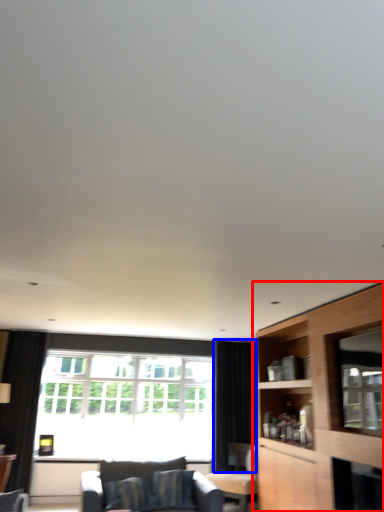
Question: Among these objects, which one is farthest to the camera, cabinetry (highlighted by a red box) or curtain (highlighted by a blue box)?

Choices:
 (A) cabinetry
 (B) curtain

Answer: (B)